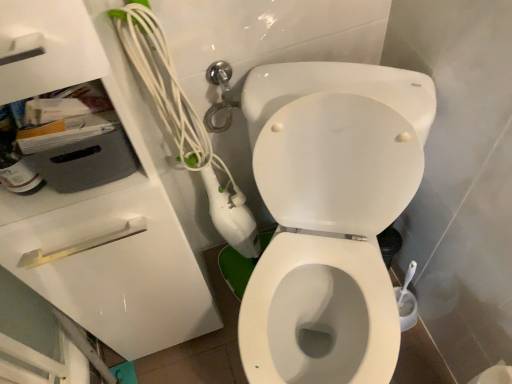
Question: Is white glossy toilet at center looking in the opposite direction of yellow plastic drawer at upper left?

Choices:
 (A) yes
 (B) no

Answer: (B)

Question: From a real-world perspective, is white glossy toilet at center on top of yellow plastic drawer at upper left?

Choices:
 (A) yes
 (B) no

Answer: (A)

Question: From the image's perspective, is white glossy toilet at center above yellow plastic drawer at upper left?

Choices:
 (A) yes
 (B) no

Answer: (A)

Question: Is white glossy toilet at center further to camera compared to yellow plastic drawer at upper left?

Choices:
 (A) yes
 (B) no

Answer: (B)

Question: Is white glossy toilet at center aimed at yellow plastic drawer at upper left?

Choices:
 (A) yes
 (B) no

Answer: (B)

Question: Is white glossy toilet at center not near yellow plastic drawer at upper left?

Choices:
 (A) yes
 (B) no

Answer: (B)

Question: Is the position of yellow plastic drawer at upper left more distant than that of white glossy toilet at center?

Choices:
 (A) yes
 (B) no

Answer: (A)

Question: Is yellow plastic drawer at upper left to the right of white glossy toilet at center from the viewer's perspective?

Choices:
 (A) yes
 (B) no

Answer: (B)

Question: Is white glossy toilet at center at the back of yellow plastic drawer at upper left?

Choices:
 (A) yes
 (B) no

Answer: (B)

Question: From a real-world perspective, is yellow plastic drawer at upper left located beneath white glossy toilet at center?

Choices:
 (A) no
 (B) yes

Answer: (B)

Question: Are yellow plastic drawer at upper left and white glossy toilet at center making contact?

Choices:
 (A) no
 (B) yes

Answer: (A)

Question: From a real-world perspective, is yellow plastic drawer at upper left on white glossy toilet at center?

Choices:
 (A) no
 (B) yes

Answer: (A)

Question: Visually, is white glossy toilet at center positioned to the left or to the right of yellow plastic drawer at upper left?

Choices:
 (A) right
 (B) left

Answer: (A)